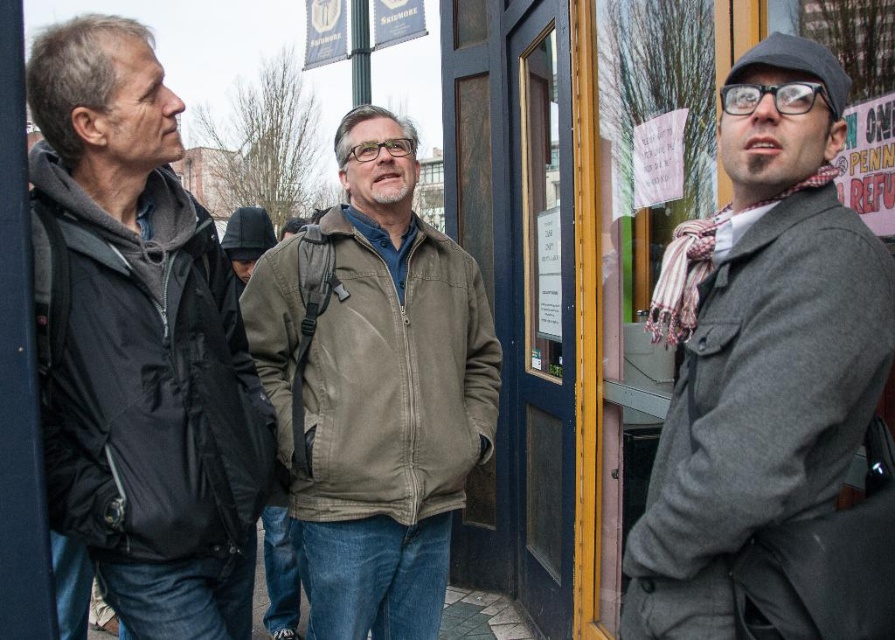
Is point (687, 429) more distant than point (132, 461)?

That is False.

Is gray wool coat at right bigger than black matte jacket at left?

Indeed, gray wool coat at right has a larger size compared to black matte jacket at left.

Which is behind, point (808, 612) or point (166, 502)?

The point (166, 502) is behind.

You are a GUI agent. You are given a task and a screenshot of the screen. Output one action in this format:
    pyautogui.click(x=<x>, y=<y>)
    Task: Click on the gray wool coat at right
    This screenshot has height=640, width=895.
    Given the screenshot: What is the action you would take?
    pyautogui.click(x=770, y=385)

Is gray wool coat at right to the right of olive-green corduroy jacket at center from the viewer's perspective?

Indeed, gray wool coat at right is positioned on the right side of olive-green corduroy jacket at center.

Is gray wool coat at right positioned in front of olive-green corduroy jacket at center?

Yes, gray wool coat at right is in front of olive-green corduroy jacket at center.

I want to click on gray wool coat at right, so click(x=770, y=385).

Who is positioned more to the right, black matte jacket at left or olive-green corduroy jacket at center?

Positioned to the right is olive-green corduroy jacket at center.

Can you confirm if black matte jacket at left is taller than olive-green corduroy jacket at center?

Incorrect, black matte jacket at left's height is not larger of olive-green corduroy jacket at center's.

Is point (124, 308) positioned after point (339, 390)?

That is False.

Locate an element on the screen. This screenshot has height=640, width=895. black matte jacket at left is located at coordinates (143, 376).